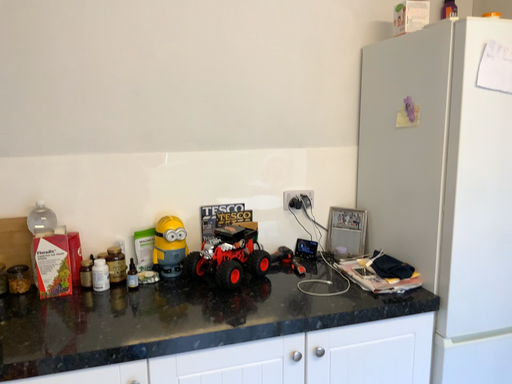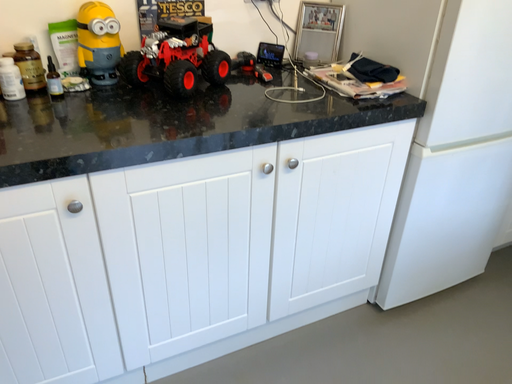
Question: How did the camera likely rotate when shooting the video?

Choices:
 (A) rotated upward
 (B) rotated downward

Answer: (B)